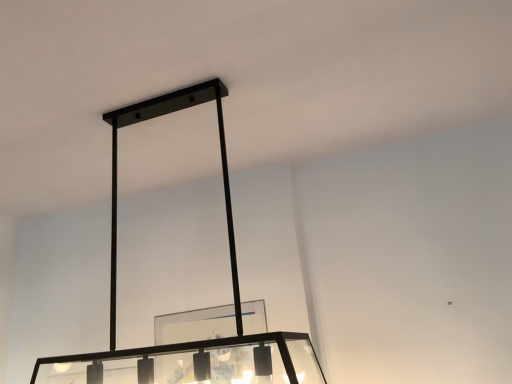
This screenshot has height=384, width=512. Identify the location of matte black frame at center. (229, 253).

The image size is (512, 384). What do you see at coordinates (229, 253) in the screenshot?
I see `matte black frame at center` at bounding box center [229, 253].

The width and height of the screenshot is (512, 384). Identify the location of matte black frame at center. (229, 253).